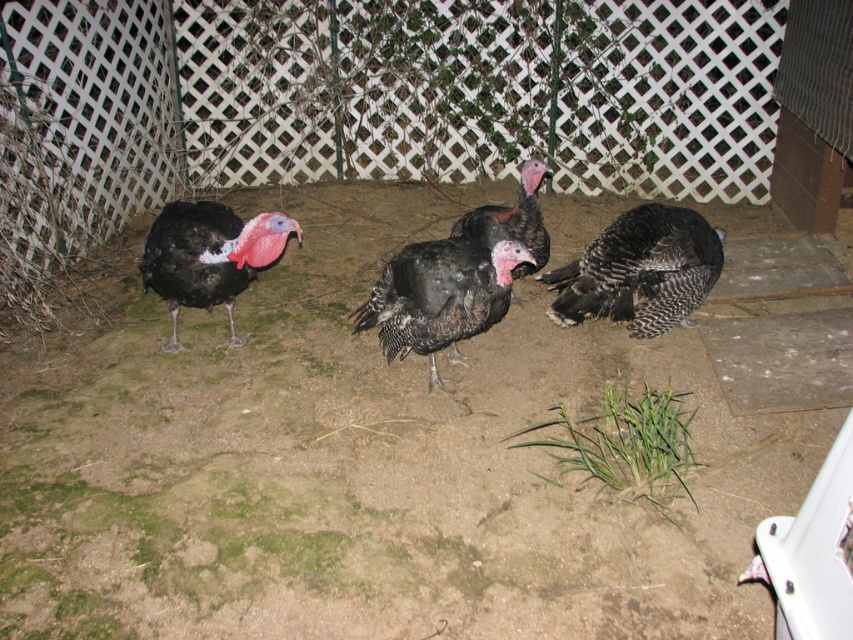
Is black feathered turkey at center closer to camera compared to black glossy turkey at center?

Yes, it is in front of black glossy turkey at center.

Can you confirm if black feathered turkey at center is thinner than black glossy turkey at center?

Incorrect, black feathered turkey at center's width is not less than black glossy turkey at center's.

Which is in front, point (485, 304) or point (524, 202)?

Positioned in front is point (485, 304).

Where is `black feathered turkey at center`? The width and height of the screenshot is (853, 640). black feathered turkey at center is located at coordinates (439, 296).

Does white lattice fence at upper center appear on the right side of matte black turkey at left?

Yes, white lattice fence at upper center is to the right of matte black turkey at left.

Which is below, white lattice fence at upper center or matte black turkey at left?

matte black turkey at left is lower down.

Does point (242, 49) come farther from viewer compared to point (260, 241)?

Yes, it is.

Find the location of a particular element. white lattice fence at upper center is located at coordinates (399, 92).

Is black textured feathers at center positioned at the back of black glossy turkey at center?

That is False.

Who is positioned more to the right, black textured feathers at center or black glossy turkey at center?

black textured feathers at center is more to the right.

Describe the element at coordinates (640, 269) in the screenshot. I see `black textured feathers at center` at that location.

Locate an element on the screen. black textured feathers at center is located at coordinates (640, 269).